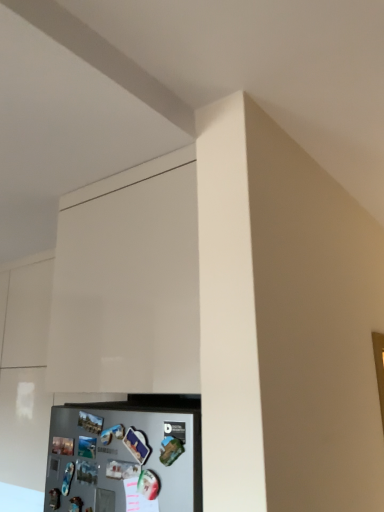
Question: Is white glossy cabinet at upper center positioned beyond the bounds of satin silver refrigerator at lower left?

Choices:
 (A) yes
 (B) no

Answer: (A)

Question: Is white glossy cabinet at upper center behind satin silver refrigerator at lower left?

Choices:
 (A) no
 (B) yes

Answer: (B)

Question: Can you confirm if white glossy cabinet at upper center is thinner than satin silver refrigerator at lower left?

Choices:
 (A) yes
 (B) no

Answer: (B)

Question: Considering the relative sizes of white glossy cabinet at upper center and satin silver refrigerator at lower left in the image provided, is white glossy cabinet at upper center bigger than satin silver refrigerator at lower left?

Choices:
 (A) yes
 (B) no

Answer: (A)

Question: Does white glossy cabinet at upper center touch satin silver refrigerator at lower left?

Choices:
 (A) yes
 (B) no

Answer: (B)

Question: Considering the relative positions of white glossy cabinet at upper center and satin silver refrigerator at lower left in the image provided, is white glossy cabinet at upper center in front of satin silver refrigerator at lower left?

Choices:
 (A) no
 (B) yes

Answer: (A)

Question: Does satin silver refrigerator at lower left have a smaller size compared to white glossy cabinet at upper center?

Choices:
 (A) yes
 (B) no

Answer: (A)

Question: From the image's perspective, is satin silver refrigerator at lower left located beneath white glossy cabinet at upper center?

Choices:
 (A) yes
 (B) no

Answer: (A)

Question: Considering the relative sizes of satin silver refrigerator at lower left and white glossy cabinet at upper center in the image provided, is satin silver refrigerator at lower left taller than white glossy cabinet at upper center?

Choices:
 (A) no
 (B) yes

Answer: (A)

Question: Would you say satin silver refrigerator at lower left is outside white glossy cabinet at upper center?

Choices:
 (A) no
 (B) yes

Answer: (B)

Question: Is satin silver refrigerator at lower left positioned with its back to white glossy cabinet at upper center?

Choices:
 (A) no
 (B) yes

Answer: (A)

Question: From a real-world perspective, is satin silver refrigerator at lower left positioned over white glossy cabinet at upper center based on gravity?

Choices:
 (A) yes
 (B) no

Answer: (B)

Question: Looking at their shapes, would you say white glossy cabinet at upper center is wider or thinner than satin silver refrigerator at lower left?

Choices:
 (A) thin
 (B) wide

Answer: (B)